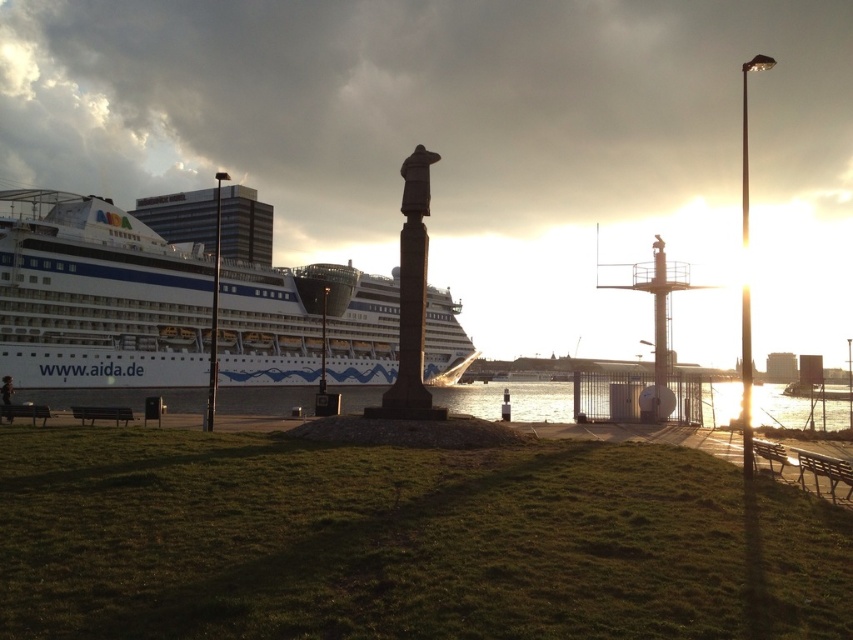
You are standing at the camera position looking at the waterfront scene. There are two points marked in the image, one at coordinates point (762, 452) and another at point (10, 406). Which of these points is nearer to your current position?

Point (762, 452) is closer to the camera than point (10, 406), so the point at coordinates point (762, 452) is nearer to your current position.

You are a photographer trying to capture the white glossy cruise ship at left and the wooden park bench at lower right in the same frame. However, you notice that the cruise ship is blocking the view of the bench. Can you adjust your position to see both objects clearly without any obstruction?

The white glossy cruise ship at left is positioned over the wooden park bench at lower right, so moving your position to the side or adjusting your angle might allow you to see both objects without obstruction.

You are planning to set up a small picnic area between the wooden park bench at lower right and the wooden bench at lower left. The picnic blanket you have is 100 feet long. Will the blanket fit between the two benches without overlapping either bench?

The distance between the wooden park bench at lower right and the wooden bench at lower left is 128.97 feet. Since the picnic blanket is only 100 feet long, it will not be long enough to span the entire distance between the two benches. However, if placed strategically, it could cover part of the area between them, but it will not reach both benches without overlapping.